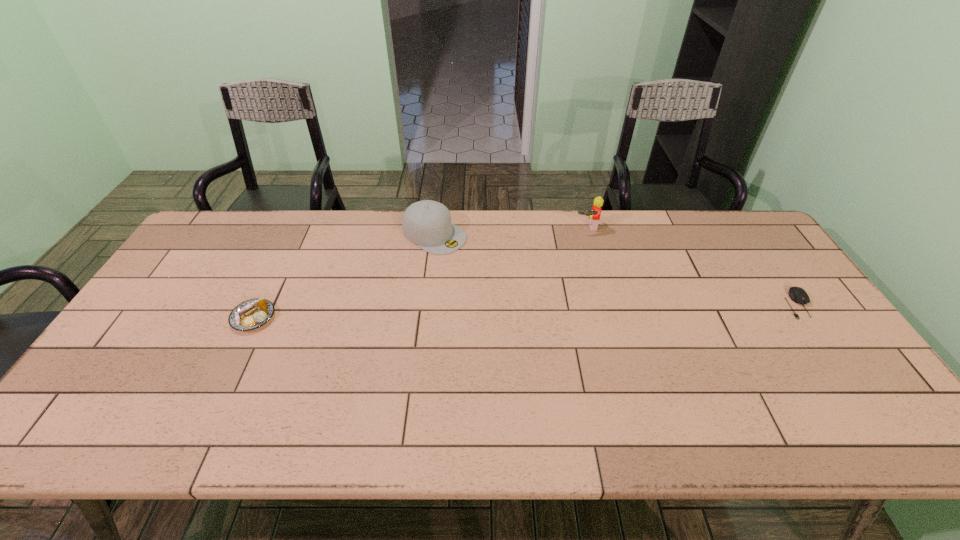
I want to click on vacant space at the near edge of the desktop, so click(x=212, y=392).

The width and height of the screenshot is (960, 540). In the image, there is a desktop. What are the coordinates of `vacant space at the left edge` in the screenshot? It's located at (141, 336).

Locate an element on the screen. The height and width of the screenshot is (540, 960). free space at the right edge of the desktop is located at coordinates (750, 259).

In the image, there is a desktop. Where is `vacant space at the far left corner`? vacant space at the far left corner is located at coordinates (253, 221).

The width and height of the screenshot is (960, 540). In order to click on vacant space at the far right corner of the desktop in this screenshot , I will do `click(746, 239)`.

The width and height of the screenshot is (960, 540). In order to click on empty location between the second tallest object and the pastry in this screenshot , I will do `click(344, 276)`.

Identify the location of empty space between the second tallest object and the third tallest object. (344, 276).

I want to click on free space that is in between the Lego and the pastry, so click(x=420, y=272).

Find the location of `free spot between the Lego and the leftmost object`. free spot between the Lego and the leftmost object is located at coordinates (420, 272).

You are a GUI agent. You are given a task and a screenshot of the screen. Output one action in this format:
    pyautogui.click(x=<x>, y=<y>)
    Task: Click on the blank region between the tallest object and the shortest object
    The width and height of the screenshot is (960, 540).
    Given the screenshot: What is the action you would take?
    pos(692,265)